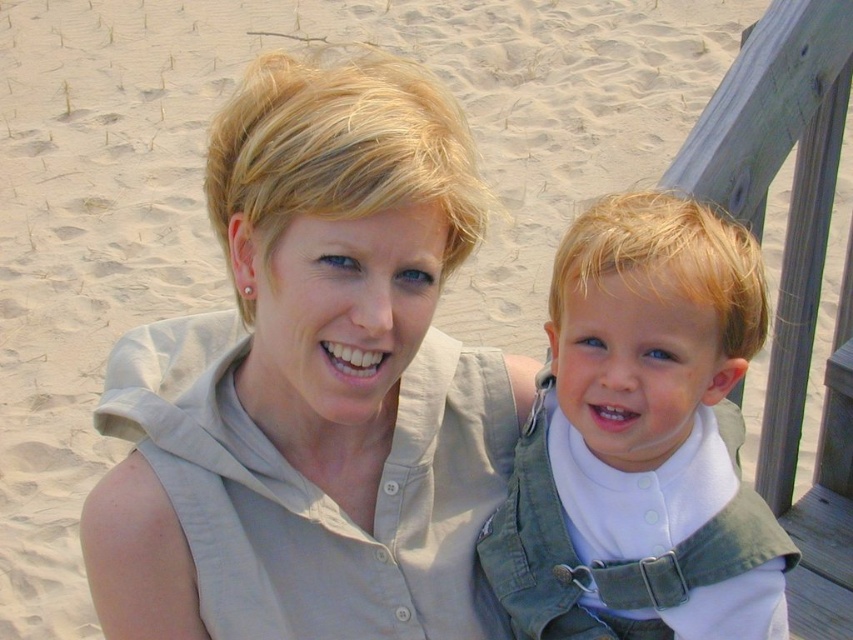
You are a photographer trying to capture a photo of the matte beige shirt at upper center and the light green denim overalls at center. Which object is positioned higher in the frame?

The matte beige shirt at upper center is positioned higher in the frame than the light green denim overalls at center.